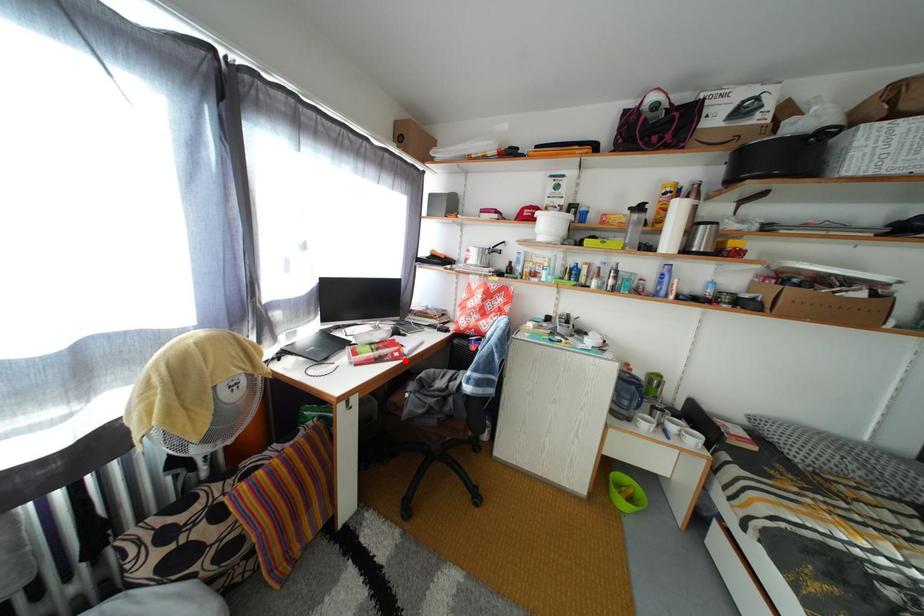
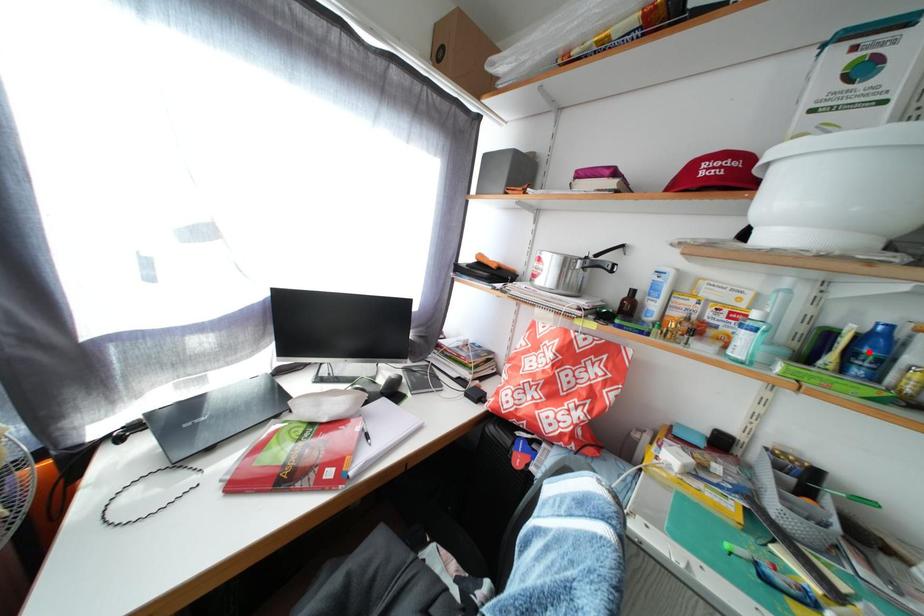
I am providing you with two images of the same scene from different viewpoints. A red point is marked on the first image and another point is marked on the second image. Does the point marked in image1 correspond to the same location as the one in image2?

No